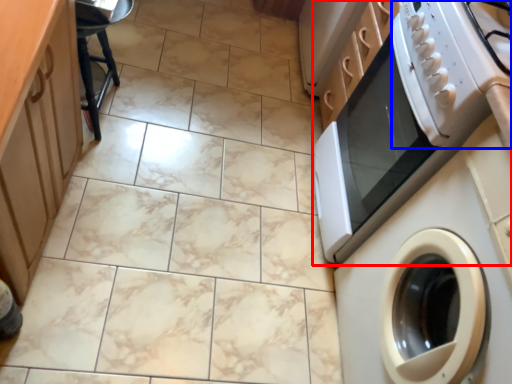
Question: Which point is further to the camera, home appliance (highlighted by a red box) or gas stove (highlighted by a blue box)?

Choices:
 (A) home appliance
 (B) gas stove

Answer: (A)